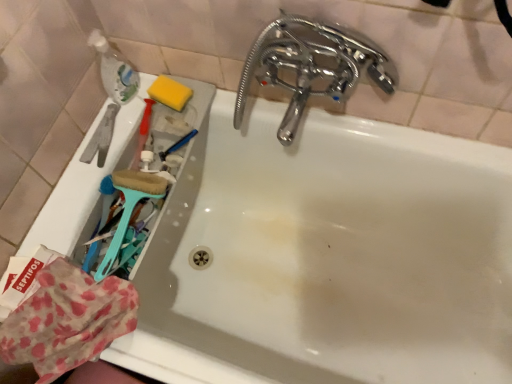
At what (x,y) coordinates should I click in order to perform the action: click on free space in front of translucent plastic bottle at upper left. Please return your answer as a coordinate pair (x, y). This screenshot has width=512, height=384. Looking at the image, I should click on (135, 140).